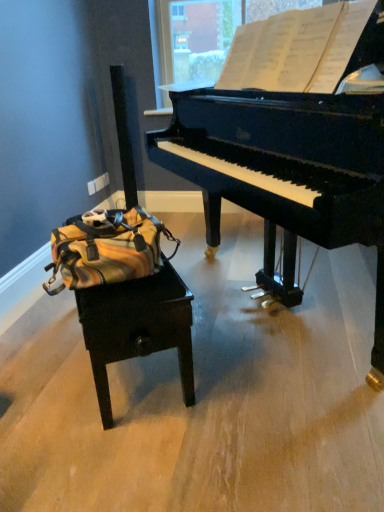
This screenshot has height=512, width=384. Identify the location of vacant space that is to the left of wooden table at lower left. (42, 346).